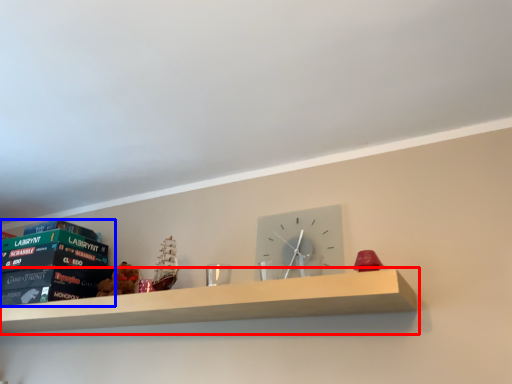
Question: Which object is further to the camera taking this photo, shelf (highlighted by a red box) or paperback book (highlighted by a blue box)?

Choices:
 (A) shelf
 (B) paperback book

Answer: (B)